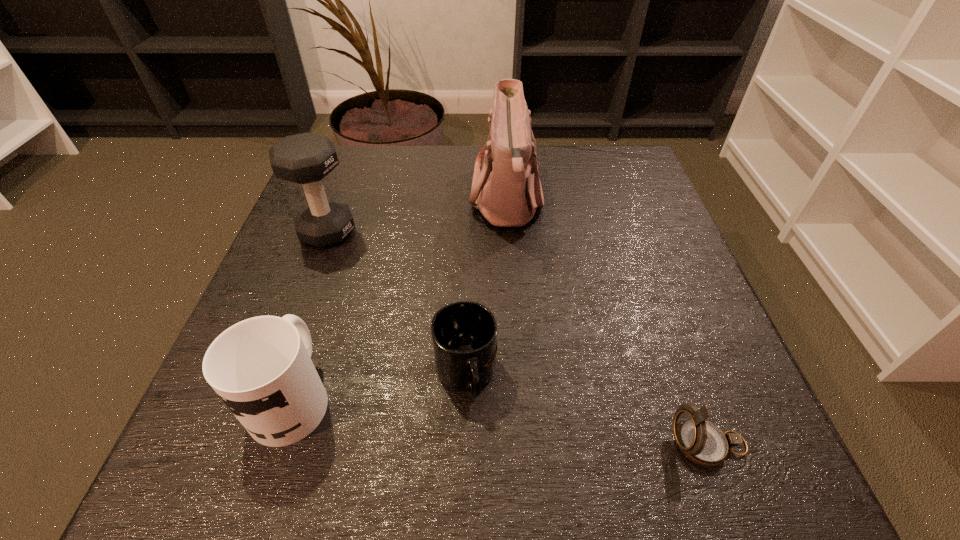
At what (x,y) coordinates should I click in order to perform the action: click on free spot located 0.100m on the handle side of the third tallest object. Please return your answer as a coordinate pair (x, y). This screenshot has width=960, height=540. Looking at the image, I should click on (322, 306).

Where is `vacant area situated on the handle side of the third tallest object`? This screenshot has width=960, height=540. vacant area situated on the handle side of the third tallest object is located at coordinates (349, 221).

This screenshot has width=960, height=540. Identify the location of vacant region located on the handle side of the third tallest object. (333, 271).

Image resolution: width=960 pixels, height=540 pixels. What are the coordinates of `vacant region located with the handle on the side of the shorter mug` in the screenshot? It's located at (463, 491).

Locate an element on the screen. The height and width of the screenshot is (540, 960). free space located 0.250m on the face of the rightmost object is located at coordinates (491, 444).

At what (x,y) coordinates should I click in order to perform the action: click on vacant space located 0.110m on the face of the rightmost object. Please return your answer as a coordinate pair (x, y). Image resolution: width=960 pixels, height=540 pixels. Looking at the image, I should click on [591, 444].

Where is `vacant space located 0.160m on the face of the rightmost object`? This screenshot has height=540, width=960. vacant space located 0.160m on the face of the rightmost object is located at coordinates (555, 444).

Locate an element on the screen. The height and width of the screenshot is (540, 960). object that is at the far edge is located at coordinates (507, 190).

Where is `mug situated at the near edge`? The width and height of the screenshot is (960, 540). mug situated at the near edge is located at coordinates (261, 367).

What are the coordinates of `compass that is positioned at the near edge` in the screenshot? It's located at (702, 442).